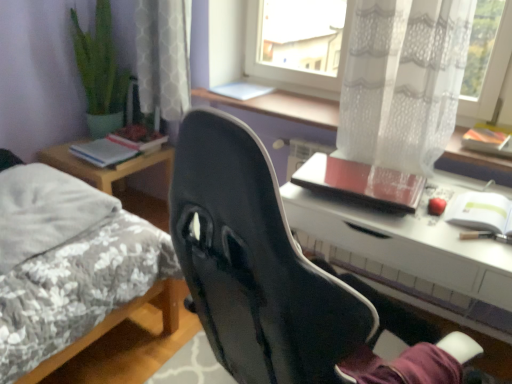
Image resolution: width=512 pixels, height=384 pixels. What do you see at coordinates (281, 278) in the screenshot?
I see `black matte chair at center` at bounding box center [281, 278].

The height and width of the screenshot is (384, 512). Find the location of `fluffy gray bed at left`. fluffy gray bed at left is located at coordinates (114, 326).

What do you see at coordinates (482, 215) in the screenshot? The height and width of the screenshot is (384, 512). I see `white paper notebook at right, which is counted as the second notebook, starting from the left` at bounding box center [482, 215].

Find the location of a particular element. The image size is (512, 384). white lace curtain at upper center, which is counted as the second curtain, starting from the front is located at coordinates (163, 57).

From the image's perspective, who appears lower, black matte chair at center or transparent lace curtain at upper center?

black matte chair at center.

Based on the photo, which is farther, (200, 237) or (291, 82)?

The point (291, 82) is farther from the camera.

Image resolution: width=512 pixels, height=384 pixels. Identify the location of chair to the left of transparent lace curtain at upper center. (281, 278).

How many degrees apart are the facing directions of black matte chair at center and transparent lace curtain at upper center?

They differ by 167 degrees in their facing directions.

Are white paper notebook at right, which is counted as the second notebook, starting from the left, and matte red notebook at upper right, the first notebook in the left-to-right sequence, located far from each other?

They are positioned close to each other.

Measure the distance between white paper notebook at right, which is counted as the second notebook, starting from the left, and matte red notebook at upper right, the first notebook in the left-to-right sequence.

The distance of white paper notebook at right, which is counted as the second notebook, starting from the left, from matte red notebook at upper right, the first notebook in the left-to-right sequence, is 10.52 inches.

Is white paper notebook at right, which is counted as the second notebook, starting from the left, taller or shorter than matte red notebook at upper right, the first notebook in the left-to-right sequence?

white paper notebook at right, which is counted as the second notebook, starting from the left, is shorter than matte red notebook at upper right, the first notebook in the left-to-right sequence.

Who is bigger, white paper notebook at right, which is counted as the second notebook, starting from the right, or matte red notebook at upper right, the first notebook in the left-to-right sequence?

matte red notebook at upper right, the first notebook in the left-to-right sequence, is bigger.

Considering their positions, is transparent lace curtain at upper center located in front of or behind orange matte notebook at upper right, which ranks as the 1th notebook in right-to-left order?

transparent lace curtain at upper center is positioned farther from the viewer than orange matte notebook at upper right, which ranks as the 1th notebook in right-to-left order.

Based on the photo, between transparent lace curtain at upper center and orange matte notebook at upper right, which ranks as the 3th notebook in left-to-right order, which one has larger size?

transparent lace curtain at upper center is bigger.

Is point (264, 78) positioned after point (506, 142)?

Yes.

Considering the sizes of objects transparent lace curtain at upper center and orange matte notebook at upper right, which ranks as the 3th notebook in left-to-right order, in the image provided, who is thinner, transparent lace curtain at upper center or orange matte notebook at upper right, which ranks as the 3th notebook in left-to-right order,?

With smaller width is transparent lace curtain at upper center.

From the picture: From a real-world perspective, between white paper notebook at right, which is counted as the second notebook, starting from the right, and hardcover book at left, which is counted as the first book, starting from the back, who is vertically higher?

white paper notebook at right, which is counted as the second notebook, starting from the right, from a real-world perspective.

Is white paper notebook at right, which is counted as the second notebook, starting from the left, turned away from hardcover book at left, which is the second book in front-to-back order?

No, white paper notebook at right, which is counted as the second notebook, starting from the left, is not facing away from hardcover book at left, which is the second book in front-to-back order.

Would you say white paper notebook at right, which is counted as the second notebook, starting from the right, is to the left or to the right of hardcover book at left, which is counted as the first book, starting from the back, in the picture?

Based on their positions, white paper notebook at right, which is counted as the second notebook, starting from the right, is located to the right of hardcover book at left, which is counted as the first book, starting from the back.

Is white paper notebook at right, which is counted as the second notebook, starting from the right, smaller than hardcover book at left, which is counted as the first book, starting from the back?

Correct, white paper notebook at right, which is counted as the second notebook, starting from the right, occupies less space than hardcover book at left, which is counted as the first book, starting from the back.

Does white paper notebook at right, which is counted as the second notebook, starting from the left, have a lesser width compared to transparent lace curtain at upper center?

In fact, white paper notebook at right, which is counted as the second notebook, starting from the left, might be wider than transparent lace curtain at upper center.

Is white paper notebook at right, which is counted as the second notebook, starting from the right, located outside transparent lace curtain at upper center?

Yes, white paper notebook at right, which is counted as the second notebook, starting from the right, is located beyond the bounds of transparent lace curtain at upper center.

Between white paper notebook at right, which is counted as the second notebook, starting from the right, and transparent lace curtain at upper center, which one has more height?

transparent lace curtain at upper center.

How many degrees apart are the facing directions of white glossy desk at center and hardcover book at left, which is counted as the first book, starting from the back?

There is a 85.3-degree angle between the facing directions of white glossy desk at center and hardcover book at left, which is counted as the first book, starting from the back.

From the image's perspective, does white glossy desk at center appear lower than hardcover book at left, which is the second book in front-to-back order?

Yes, from the image's perspective, white glossy desk at center is below hardcover book at left, which is the second book in front-to-back order.

Find the location of a particular element. The width and height of the screenshot is (512, 384). the 2nd book above the white glossy desk at center (from the image's perspective) is located at coordinates (138, 138).

What's the angular difference between white glossy desk at center and black matte chair at center's facing directions?

white glossy desk at center and black matte chair at center are facing 164 degrees away from each other.

Considering the positions of objects white glossy desk at center and black matte chair at center in the image provided, who is in front, white glossy desk at center or black matte chair at center?

black matte chair at center is closer to the camera.

Locate an element on the screen. The width and height of the screenshot is (512, 384). chair that is above the white glossy desk at center (from the image's perspective) is located at coordinates (281, 278).

Locate an element on the screen. The width and height of the screenshot is (512, 384). window that appears on the right of black matte chair at center is located at coordinates (290, 69).

The width and height of the screenshot is (512, 384). I want to click on the 1st notebook directly above the white paper notebook at right, which is counted as the second notebook, starting from the left (from a real-world perspective), so click(361, 182).

Based on their spatial positions, is white lace curtain at upper right, the first curtain when ordered from right to left, or hardcover book at left, which is counted as the first book, starting from the back, further from fluffy gray bed at left?

The object further to fluffy gray bed at left is white lace curtain at upper right, the first curtain when ordered from right to left.

Based on their spatial positions, is black matte chair at center or transparent lace curtain at upper center further from fluffy white pillow at left?

transparent lace curtain at upper center.

Considering their positions, is hardcover book at left, which is counted as the first book, starting from the back, positioned closer to white lace curtain at upper right, the first curtain when ordered from right to left, than transparent lace curtain at upper center?

Based on the image, transparent lace curtain at upper center appears to be nearer to white lace curtain at upper right, the first curtain when ordered from right to left.

From the image, which object appears to be nearer to white paper notebook at right, which is counted as the second notebook, starting from the right, hardcover book at left, positioned as the first book in front-to-back order, or matte red notebook at upper right, marked as the 3th notebook in a right-to-left arrangement?

matte red notebook at upper right, marked as the 3th notebook in a right-to-left arrangement, is positioned closer to the anchor white paper notebook at right, which is counted as the second notebook, starting from the right.

Looking at the image, which one is located closer to fluffy gray bed at left, white paper notebook at right, which is counted as the second notebook, starting from the right, or white lace curtain at upper center, which is counted as the second curtain, starting from the front?

white lace curtain at upper center, which is counted as the second curtain, starting from the front, is closer to fluffy gray bed at left.

Considering their positions, is white lace curtain at upper center, which is counted as the second curtain, starting from the front, positioned closer to white glossy desk at center than transparent lace curtain at upper center?

Based on the image, transparent lace curtain at upper center appears to be nearer to white glossy desk at center.

Looking at the image, which one is located closer to orange matte notebook at upper right, which ranks as the 3th notebook in left-to-right order, white paper notebook at right, which is counted as the second notebook, starting from the left, or matte red notebook at upper right, marked as the 3th notebook in a right-to-left arrangement?

Based on the image, white paper notebook at right, which is counted as the second notebook, starting from the left, appears to be nearer to orange matte notebook at upper right, which ranks as the 3th notebook in left-to-right order.

From the image, which object appears to be farther from transparent lace curtain at upper center, black matte chair at center or matte red notebook at upper right, the first notebook in the left-to-right sequence?

black matte chair at center lies further to transparent lace curtain at upper center than the other object.

At what (x,y) coordinates should I click in order to perform the action: click on curtain between fluffy white pillow at left and transparent lace curtain at upper center in the horizontal direction. Please return your answer as a coordinate pair (x, y). This screenshot has height=384, width=512. Looking at the image, I should click on (163, 57).

Locate an element on the screen. window between white lace curtain at upper center, which is the 1th curtain in left-to-right order, and white lace curtain at upper right, arranged as the first curtain when viewed from the front is located at coordinates (290, 69).

Locate an element on the screen. notebook between fluffy gray bed at left and white glossy desk at center in the horizontal direction is located at coordinates (361, 182).

The height and width of the screenshot is (384, 512). I want to click on window situated between hardcover book at left, which is counted as the first book, starting from the back, and white lace curtain at upper right, arranged as the first curtain when viewed from the front, from left to right, so click(x=290, y=69).